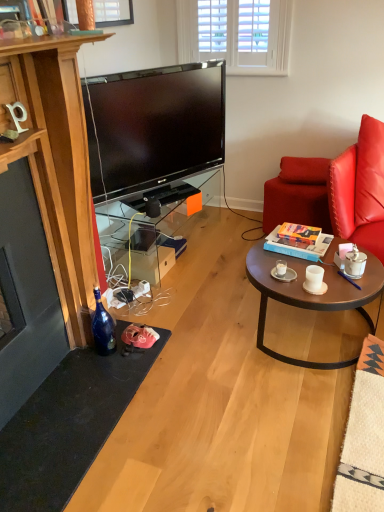
Question: Is hardcover book at center oriented away from leather cushion at right?

Choices:
 (A) no
 (B) yes

Answer: (B)

Question: From a real-world perspective, is hardcover book at center on top of leather cushion at right?

Choices:
 (A) no
 (B) yes

Answer: (A)

Question: From the image's perspective, is hardcover book at center on top of leather cushion at right?

Choices:
 (A) no
 (B) yes

Answer: (A)

Question: Considering the relative sizes of hardcover book at center and leather cushion at right in the image provided, is hardcover book at center taller than leather cushion at right?

Choices:
 (A) yes
 (B) no

Answer: (B)

Question: Can you confirm if hardcover book at center is wider than leather cushion at right?

Choices:
 (A) no
 (B) yes

Answer: (A)

Question: Relative to purple plastic pen at coffee table, is white matte coffee cup at center right, placed as the 2th coffee cup when sorted from right to left, in front or behind?

Choices:
 (A) front
 (B) behind

Answer: (A)

Question: From the image's perspective, relative to purple plastic pen at coffee table, is white matte coffee cup at center right, which ranks as the 2th coffee cup in left-to-right order, above or below?

Choices:
 (A) above
 (B) below

Answer: (A)

Question: From a real-world perspective, is white matte coffee cup at center right, which ranks as the 2th coffee cup in left-to-right order, physically located above or below purple plastic pen at coffee table?

Choices:
 (A) below
 (B) above

Answer: (B)

Question: In terms of width, does white matte coffee cup at center right, which ranks as the 2th coffee cup in left-to-right order, look wider or thinner when compared to purple plastic pen at coffee table?

Choices:
 (A) wide
 (B) thin

Answer: (B)

Question: From a real-world perspective, relative to purple plastic pen at coffee table, is hardcover book at center vertically above or below?

Choices:
 (A) below
 (B) above

Answer: (B)

Question: Would you say hardcover book at center is inside or outside purple plastic pen at coffee table?

Choices:
 (A) inside
 (B) outside

Answer: (B)

Question: Is hardcover book at center taller or shorter than purple plastic pen at coffee table?

Choices:
 (A) short
 (B) tall

Answer: (B)

Question: Is point (296, 251) positioned closer to the camera than point (337, 272)?

Choices:
 (A) closer
 (B) farther

Answer: (B)

Question: Is white matte coffee cup at center right, which ranks as the 2th coffee cup in left-to-right order, taller or shorter than leather swivel chair at right?

Choices:
 (A) short
 (B) tall

Answer: (A)

Question: Looking at their shapes, would you say white matte coffee cup at center right, which ranks as the 2th coffee cup in left-to-right order, is wider or thinner than leather swivel chair at right?

Choices:
 (A) thin
 (B) wide

Answer: (A)